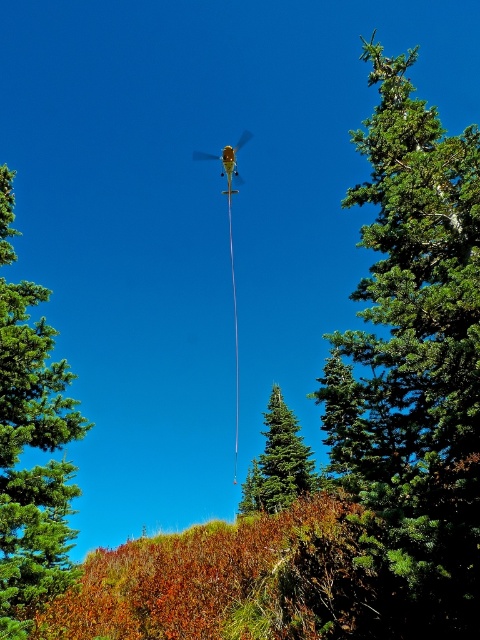
Question: Which object appears farthest from the camera in this image?

Choices:
 (A) green matte tree at left
 (B) green matte tree at center

Answer: (B)

Question: Can you confirm if green textured tree at upper right is thinner than green matte tree at center?

Choices:
 (A) no
 (B) yes

Answer: (A)

Question: Can you confirm if green matte tree at left is smaller than green matte tree at center?

Choices:
 (A) yes
 (B) no

Answer: (A)

Question: Does green textured tree at upper right have a smaller size compared to green matte tree at center?

Choices:
 (A) no
 (B) yes

Answer: (A)

Question: Which of the following is the closest to the observer?

Choices:
 (A) green textured tree at upper right
 (B) green matte tree at left
 (C) green matte tree at center

Answer: (A)

Question: Estimate the real-world distances between objects in this image. Which object is farther from the green matte tree at left?

Choices:
 (A) green textured tree at upper right
 (B) green matte tree at center

Answer: (B)